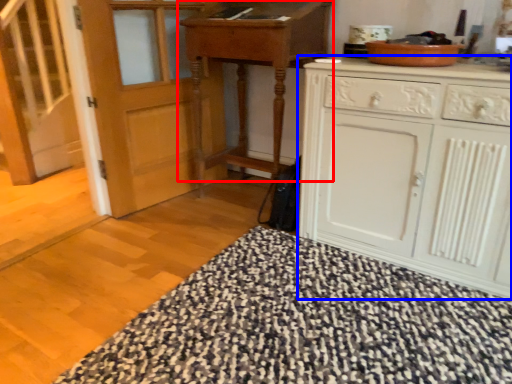
Question: Among these objects, which one is farthest to the camera, table (highlighted by a red box) or cabinetry (highlighted by a blue box)?

Choices:
 (A) table
 (B) cabinetry

Answer: (A)